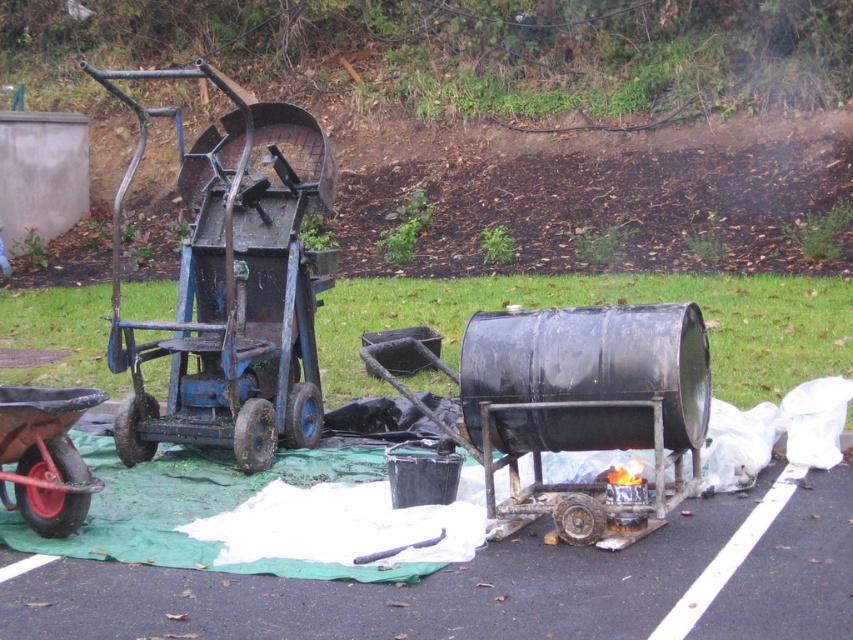
You are standing in the outdoor metalworking area and want to move a heavy object from the rusty metal wheelbarrow at lower left to the rusty metal cart at center. Which object should you approach first to start moving the object?

You should approach the rusty metal wheelbarrow at lower left first because it is closer to you than the rusty metal cart at center, which is further away.

You are a construction worker who needs to move a heavy beam from the rusty metal cart at center to the rusty metal wheelbarrow at lower left. The beam is 6 feet long. Can you safely move it without hitting anything in between?

The distance between the rusty metal cart at center and the rusty metal wheelbarrow at lower left is 7.08 feet, which is longer than the beam length of 6 feet. Therefore, you can safely move the beam without hitting anything in between.